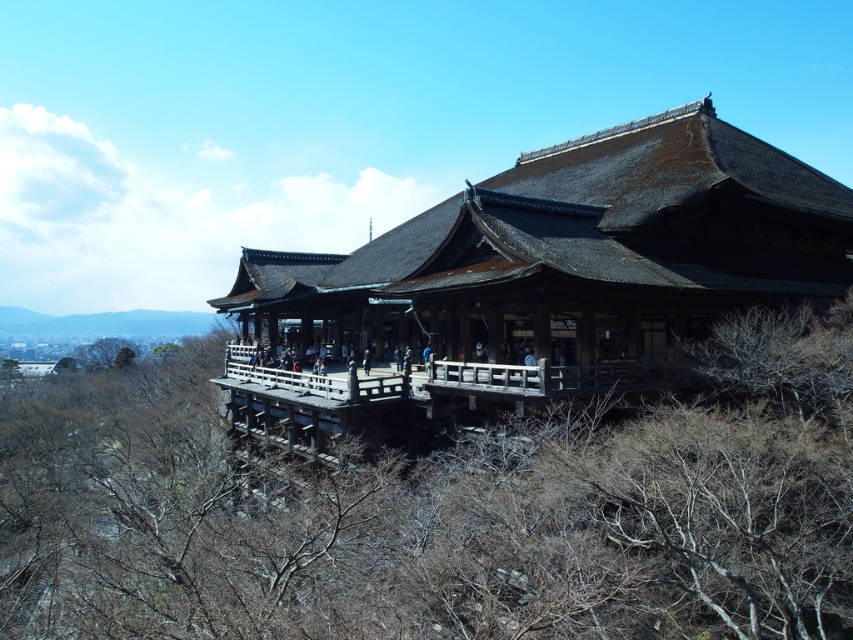
Can you confirm if brown leafless branches at lower center is positioned above thatched wood temple at center?

Incorrect, brown leafless branches at lower center is not positioned above thatched wood temple at center.

Which of these two, brown leafless branches at lower center or thatched wood temple at center, stands taller?

With more height is thatched wood temple at center.

Between point (283, 545) and point (526, 220), which one is positioned behind?

The point (526, 220) is behind.

The width and height of the screenshot is (853, 640). In order to click on brown leafless branches at lower center in this screenshot , I will do `click(440, 509)`.